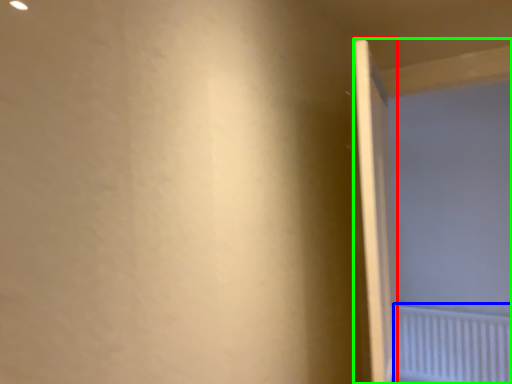
Question: Which is nearer to the door (highlighted by a red box)? radiator (highlighted by a blue box) or screen door (highlighted by a green box).

Choices:
 (A) radiator
 (B) screen door

Answer: (B)